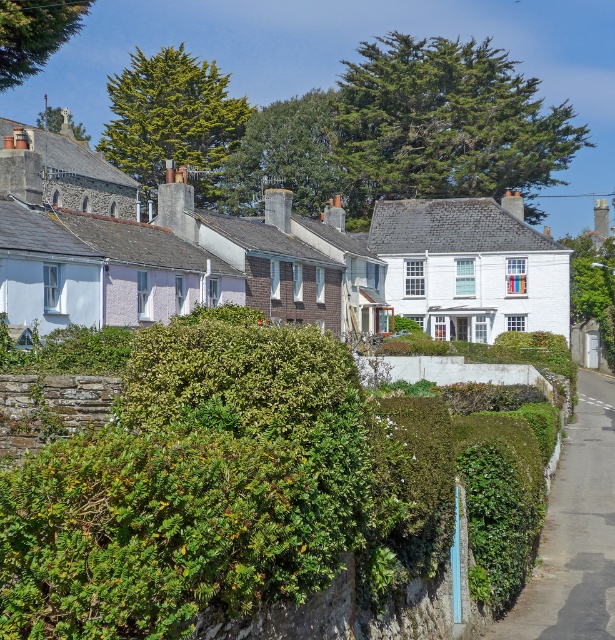
You are a gardener standing in the middle of the street looking at the green leafy hedge at center and the green leafy hedge at lower right. Which hedge is closer to you?

The green leafy hedge at center is closer to you because it is in front of the green leafy hedge at lower right.

You are a gardener planning to place a decorative stone path between the green leafy hedge at center and the green leafy hedge at lower right. Which hedge has a wider space available for the path?

→ The green leafy hedge at lower right has a wider space available because its width is greater than the green leafy hedge at center.

You are a gardener who needs to water both the green leafy hedge at center and the green leafy hedge at lower right. Your watering can holds enough water to cover 4 meters between two points. Can you water both hedges without refilling your can?

The distance between the green leafy hedge at center and the green leafy hedge at lower right is 3.97 meters, which is less than the 4 meters your watering can can cover. Therefore, you can water both hedges without needing to refill your can.